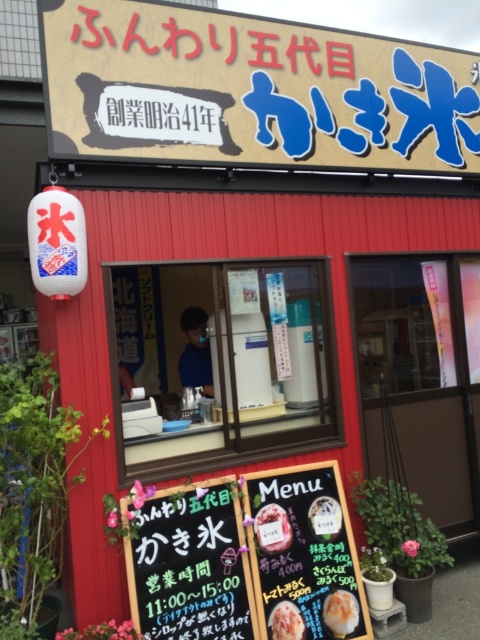
Question: Is white paper menu at lower center wider than white glossy ice cream at center?

Choices:
 (A) yes
 (B) no

Answer: (A)

Question: Considering the real-world distances, which object is farthest from the white paper menu at lower center?

Choices:
 (A) matte orange ice cream at lower center
 (B) white glossy ice cream at center

Answer: (A)

Question: Is matte orange ice cream at lower center below smooth pink ice cream at center?

Choices:
 (A) no
 (B) yes

Answer: (B)

Question: Which point is farther to the camera?

Choices:
 (A) white glossy ice cream at center
 (B) matte orange ice cream at lower center
 (C) smooth pink ice cream at center
 (D) black paper menu at lower center

Answer: (A)

Question: Is the position of smooth pink ice cream at center more distant than that of white glossy ice cream at center?

Choices:
 (A) yes
 (B) no

Answer: (B)

Question: Which point is farther to the camera?

Choices:
 (A) white paper menu at lower center
 (B) black paper menu at lower center
 (C) white glossy ice cream at center
 (D) matte cardboard signboard at upper center

Answer: (C)